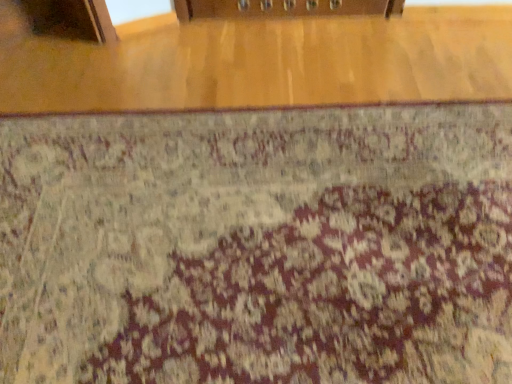
Locate an element on the screen. free space behind floral-patterned carpet at center is located at coordinates (279, 57).